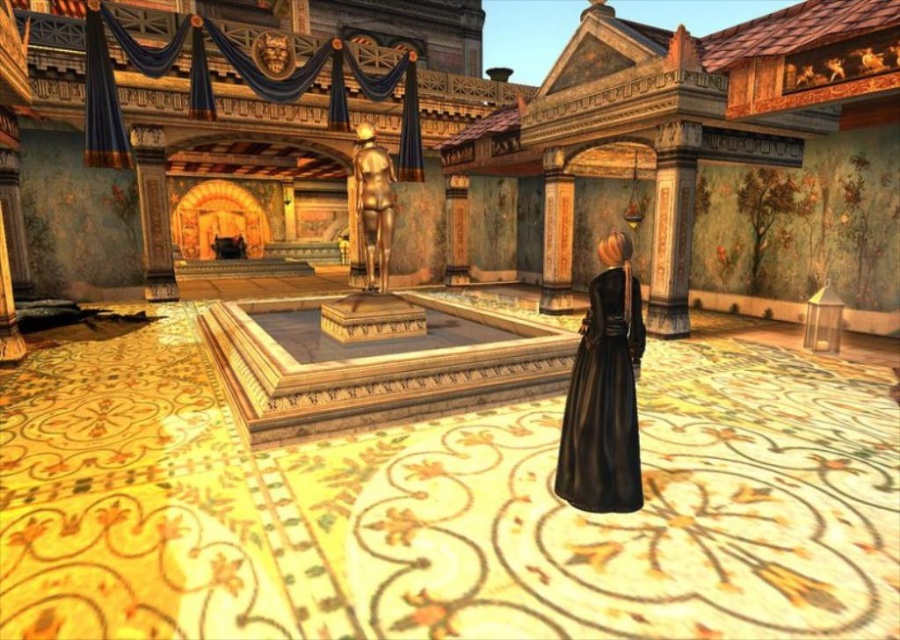
You are a guest at a formal event in this ancient Roman building and notice both the black leather dress at lower right and the gold polished statue at center. Which object is closer to you from your current position in the scene?

The black leather dress at lower right is closer to you because it is in front of the gold polished statue at center.

You are a guest attending an event in this grand Roman building. You need to find a place to temporarily store your black leather dress at lower right without obstructing the view of the gold polished statue at center. Where would you suggest placing it?

Since the black leather dress at lower right is smaller in size than the gold polished statue at center, you could place it near the base of the statue or on a nearby pedestal to keep it out of the way while still being accessible.